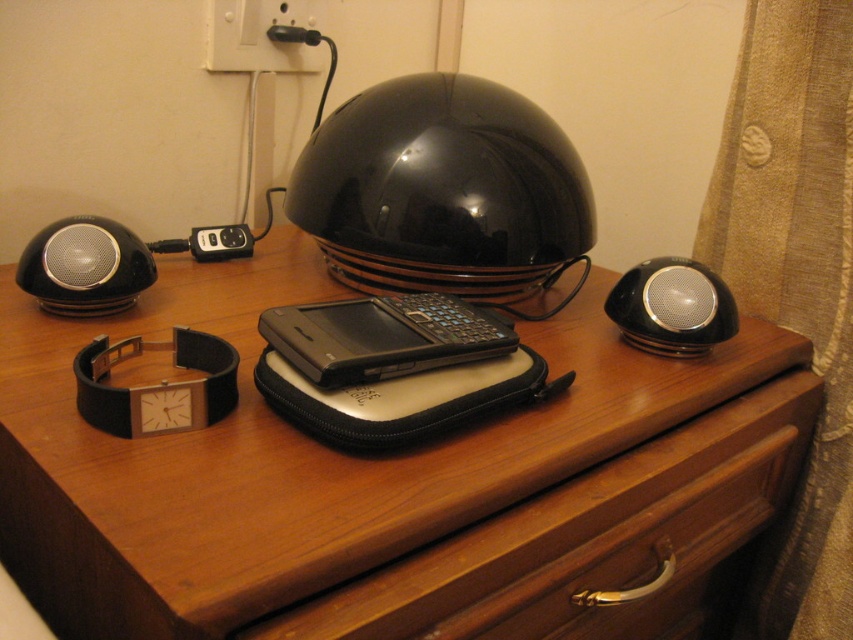
Question: Which point is farther to the camera?

Choices:
 (A) (74, 221)
 (B) (576, 600)
 (C) (194, 257)
 (D) (453, 138)

Answer: (C)

Question: Can you confirm if glossy black helmet at center is thinner than black plastic ipod at center?

Choices:
 (A) no
 (B) yes

Answer: (A)

Question: From the image, what is the correct spatial relationship of wooden drawer at center in relation to black glossy speaker at left?

Choices:
 (A) below
 (B) above

Answer: (A)

Question: Is black glossy speaker at left bigger than black metallic speaker at right?

Choices:
 (A) no
 (B) yes

Answer: (A)

Question: Which object is closer to the camera taking this photo?

Choices:
 (A) black metallic speaker at right
 (B) wooden dresser at center
 (C) glossy black helmet at center
 (D) black plastic ipod at center

Answer: (B)

Question: Among these points, which one is nearest to the camera?

Choices:
 (A) (393, 173)
 (B) (589, 584)
 (C) (49, 241)

Answer: (B)